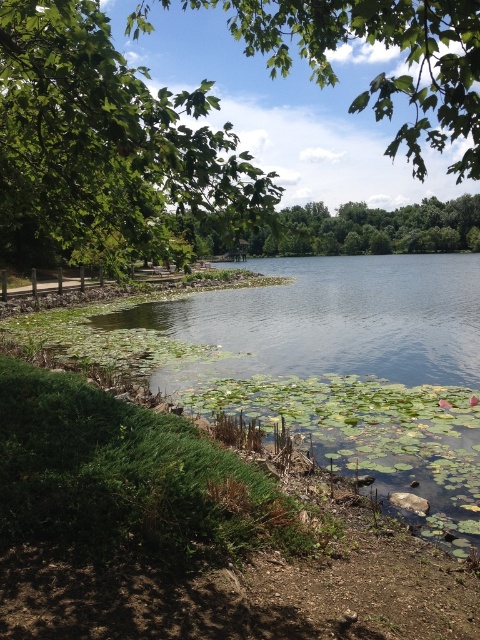
Question: Which object appears farthest from the camera in this image?

Choices:
 (A) green leafy tree at upper left
 (B) green leafy tree at center

Answer: (B)

Question: Is green leafy tree at upper left wider than green leafy tree at upper center?

Choices:
 (A) yes
 (B) no

Answer: (B)

Question: Is green leafy tree at upper center to the right of green leafy tree at center from the viewer's perspective?

Choices:
 (A) no
 (B) yes

Answer: (A)

Question: Which point is closer to the camera?

Choices:
 (A) green leafy tree at upper center
 (B) green leafy tree at upper left

Answer: (A)

Question: Which of the following is the farthest from the observer?

Choices:
 (A) (269, 186)
 (B) (436, 60)
 (C) (476, 196)

Answer: (C)

Question: Is green leafy tree at upper left behind green leafy tree at upper center?

Choices:
 (A) yes
 (B) no

Answer: (A)